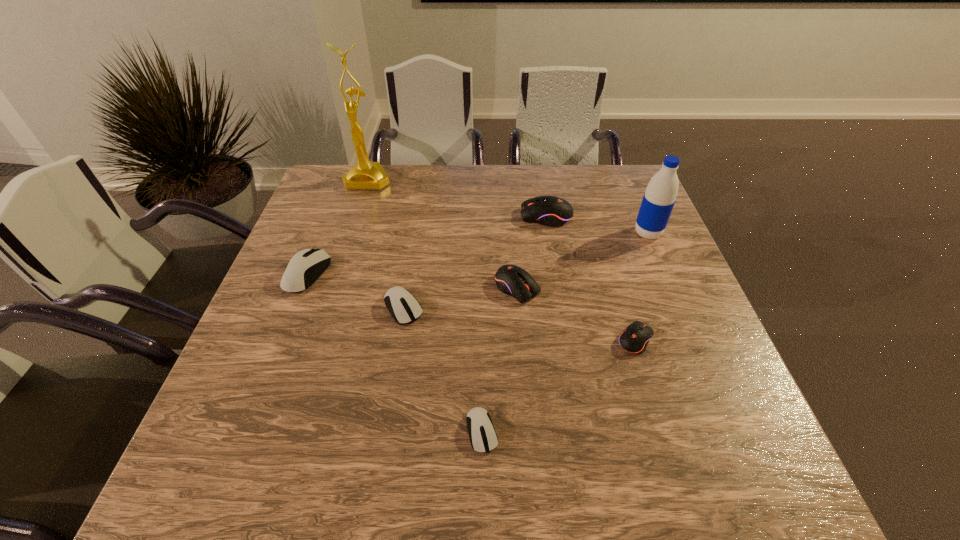
Image resolution: width=960 pixels, height=540 pixels. What are the coordinates of `the fifth mouse from right to left` in the screenshot? It's located at (403, 306).

Where is `the second object from right to left`? This screenshot has height=540, width=960. the second object from right to left is located at coordinates (635, 338).

The image size is (960, 540). I want to click on the rightmost mouse, so click(x=635, y=338).

This screenshot has height=540, width=960. Find the location of `the rightmost white mouse`. the rightmost white mouse is located at coordinates (483, 438).

In order to click on the nearest mouse in this screenshot , I will do `click(483, 438)`.

I want to click on free space located 0.370m on the front-facing side of the tallest object, so point(336,275).

At what (x,y) coordinates should I click in order to perform the action: click on vacant space located on the back of the water bottle. Please return your answer as a coordinate pair (x, y). Looking at the image, I should click on (637, 210).

Where is `free location located 0.160m on the front of the tallest mouse`? free location located 0.160m on the front of the tallest mouse is located at coordinates point(555,267).

The width and height of the screenshot is (960, 540). What are the coordinates of `free location located 0.320m on the back of the leftmost white mouse` in the screenshot? It's located at (342, 186).

Find the location of a particular element. This screenshot has height=540, width=960. free region located 0.380m on the back of the second biggest black computer mouse is located at coordinates coord(509,187).